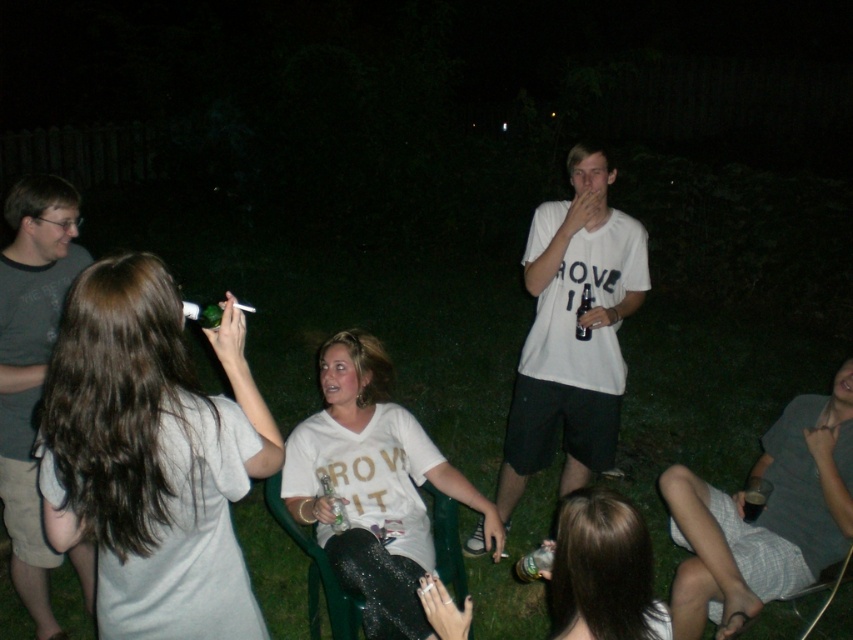
Question: Which of the following is the farthest from the observer?

Choices:
 (A) white matte t-shirt at center
 (B) matte gray shirt at upper left
 (C) gray t-shirt at left

Answer: (A)

Question: Is white matte shirt at center above matte white shirt at lower center?

Choices:
 (A) no
 (B) yes

Answer: (A)

Question: Based on their relative distances, which object is nearer to the matte white shirt at lower center?

Choices:
 (A) white matte t-shirt at center
 (B) gray cotton shirt at lower right

Answer: (B)

Question: Which object appears farthest from the camera in this image?

Choices:
 (A) matte gray shirt at upper left
 (B) white matte t-shirt at center

Answer: (B)

Question: In this image, where is matte gray shirt at upper left located relative to gray cotton shirt at lower right?

Choices:
 (A) below
 (B) above

Answer: (B)

Question: Does matte gray shirt at upper left appear over white matte shirt at center?

Choices:
 (A) yes
 (B) no

Answer: (A)